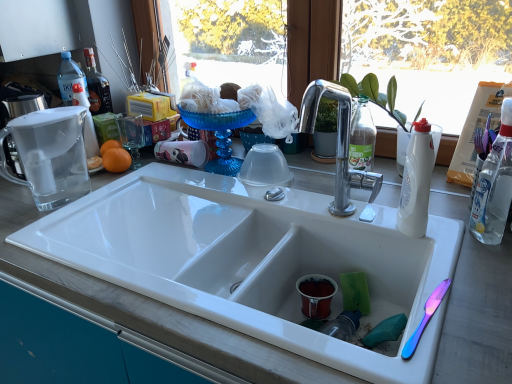
Locate an element on the screen. The width and height of the screenshot is (512, 384). free space behind white plastic bottle at right, the second bottle when ordered from right to left is located at coordinates (377, 202).